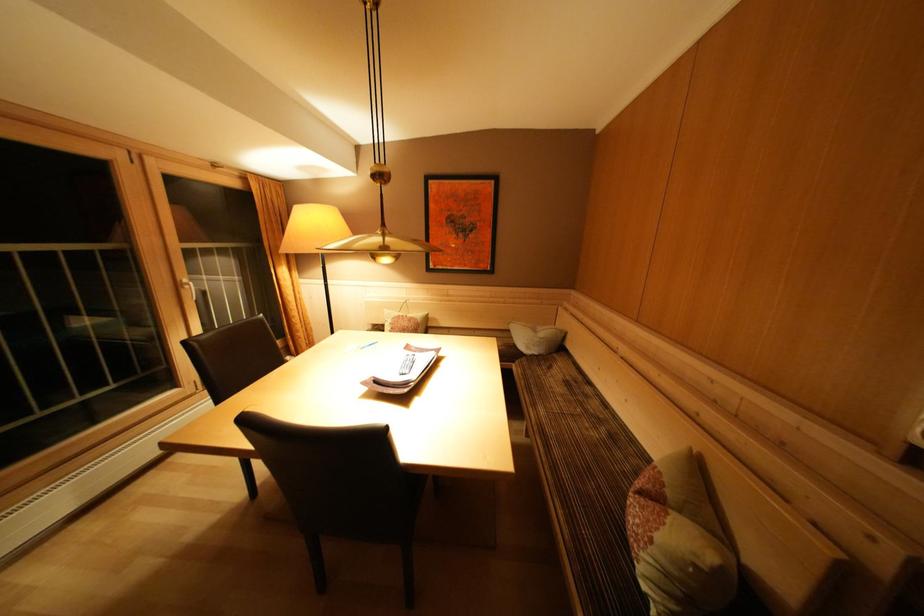
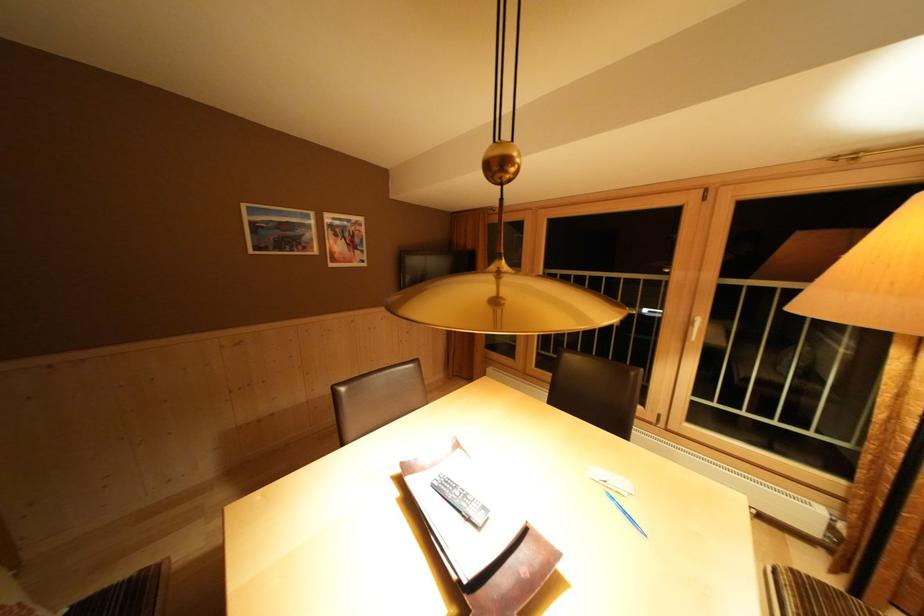
The point at (185, 292) is marked in the first image. Where is the corresponding point in the second image?

(697, 328)